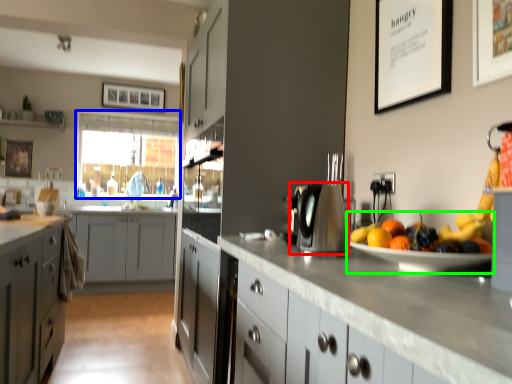
Question: Considering the real-world distances, which object is closest to kitchen appliance (highlighted by a red box)? window screen (highlighted by a blue box) or fruit dish (highlighted by a green box).

Choices:
 (A) window screen
 (B) fruit dish

Answer: (B)